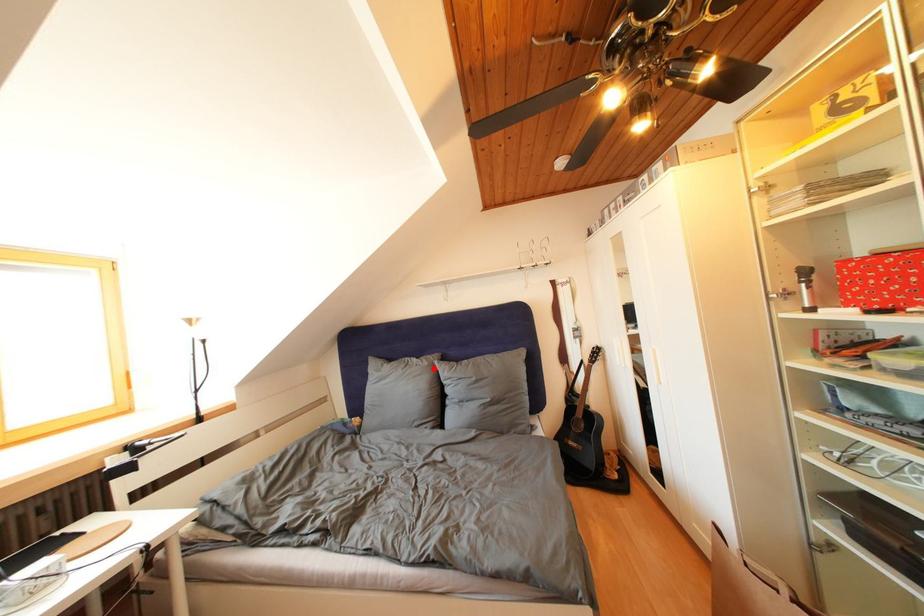
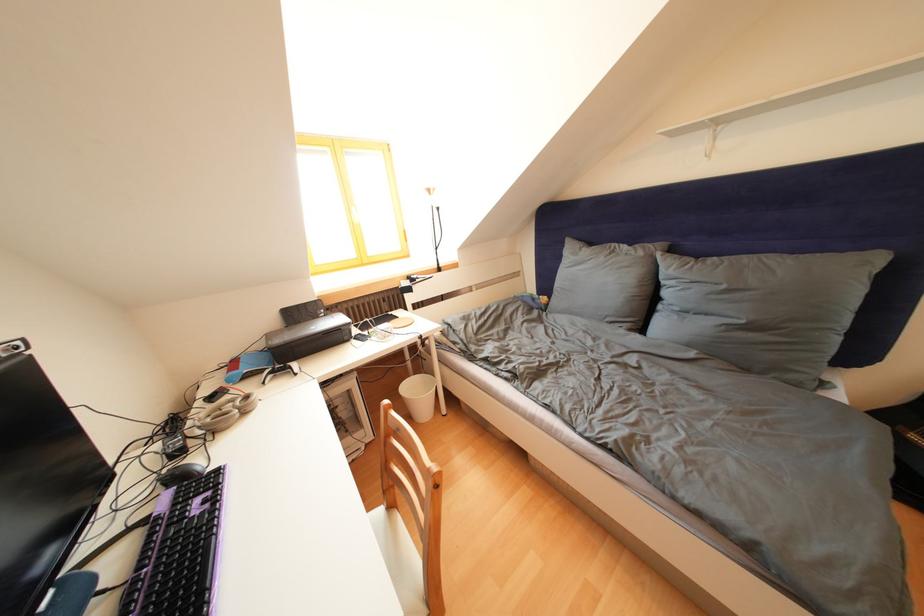
Find the pixel in the second image that matches the highlighted location in the first image.

(649, 259)